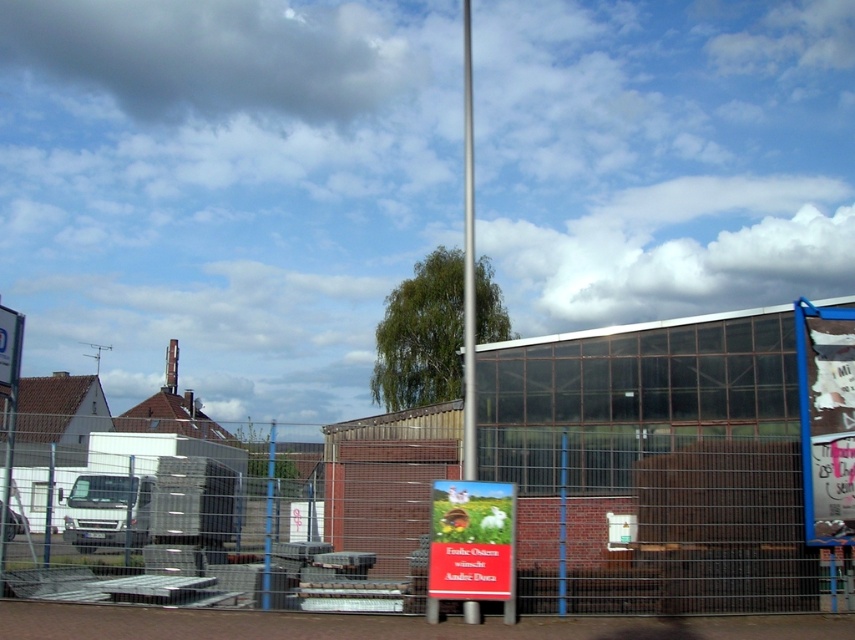
Does metallic flag pole at center have a greater width compared to metallic pole at center?

In fact, metallic flag pole at center might be narrower than metallic pole at center.

Is point (469, 8) closer to viewer compared to point (268, 448)?

No, it is behind (268, 448).

Which is behind, point (472, 198) or point (264, 589)?

The point (472, 198) is behind.

You are a GUI agent. You are given a task and a screenshot of the screen. Output one action in this format:
    pyautogui.click(x=<x>, y=<y>)
    Task: Click on the metallic flag pole at center
    
    Given the screenshot: What is the action you would take?
    pyautogui.click(x=469, y=264)

Does metallic wire mesh fence at center come behind metallic flag pole at center?

No, it is not.

Can you confirm if metallic wire mesh fence at center is positioned to the left of metallic flag pole at center?

Correct, you'll find metallic wire mesh fence at center to the left of metallic flag pole at center.

Image resolution: width=855 pixels, height=640 pixels. Describe the element at coordinates (661, 524) in the screenshot. I see `metallic wire mesh fence at center` at that location.

The image size is (855, 640). I want to click on metallic wire mesh fence at center, so click(661, 524).

Which of these two, metallic wire mesh fence at center or white paper sign at center, stands shorter?

white paper sign at center is shorter.

Is the position of metallic wire mesh fence at center less distant than that of white paper sign at center?

No, it is behind white paper sign at center.

Does point (326, 588) come behind point (499, 497)?

That is True.

I want to click on metallic wire mesh fence at center, so click(x=661, y=524).